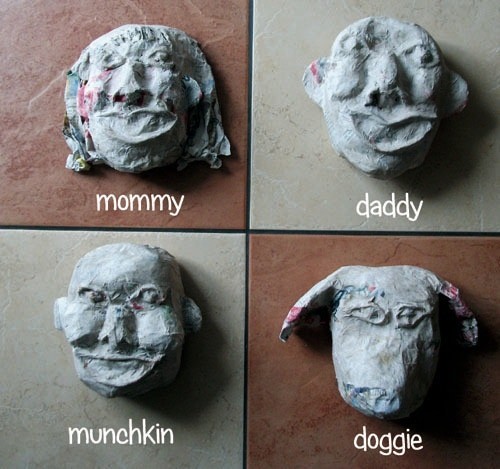
You are a GUI agent. You are given a task and a screenshot of the screen. Output one action in this format:
    pyautogui.click(x=<x>, y=<y>)
    Task: Click on the brown tile
    
    Given the screenshot: What is the action you would take?
    pyautogui.click(x=21, y=137), pyautogui.click(x=283, y=287)